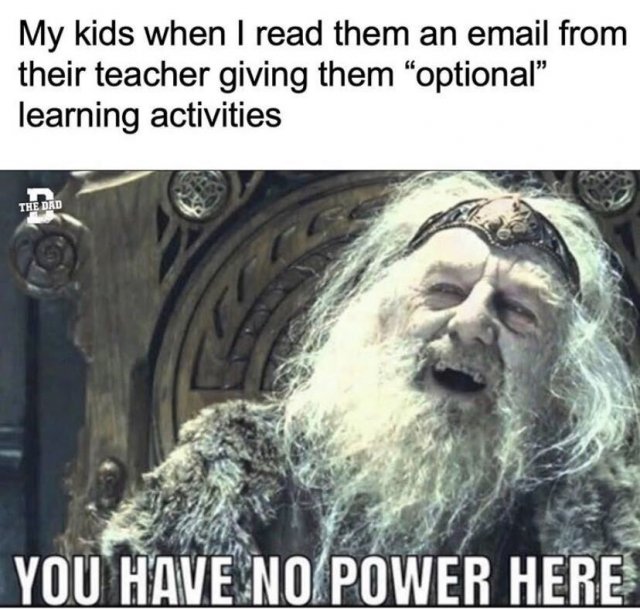
Identify the location of throne. The height and width of the screenshot is (609, 640). (240, 322).